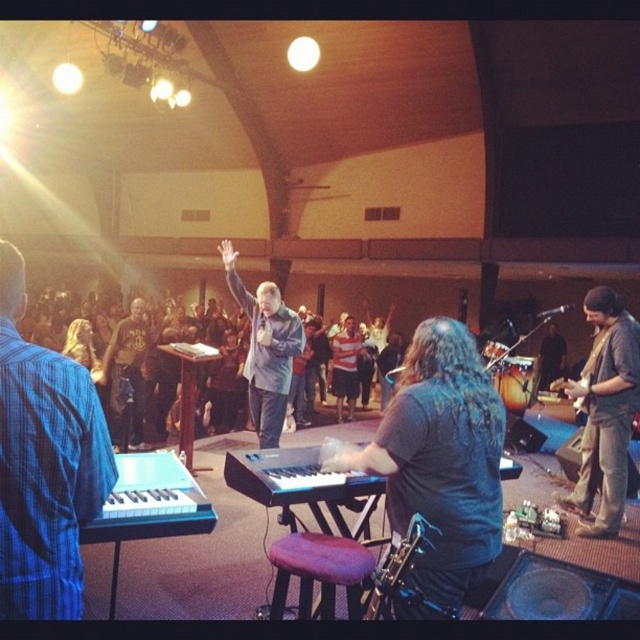
Question: Is purple fabric stool at center smaller than dark brown leather jacket at center?

Choices:
 (A) no
 (B) yes

Answer: (B)

Question: Is purple fabric stool at center positioned before metallic silver saxophone at center?

Choices:
 (A) yes
 (B) no

Answer: (B)

Question: Estimate the real-world distances between objects in this image. Which object is closer to the blue plaid shirt at left?

Choices:
 (A) dark brown leather jacket at center
 (B) matte gray suit at center
 (C) black plastic keyboard at center

Answer: (C)

Question: Which object is the closest to the dark brown leather jacket at center?

Choices:
 (A) matte gray suit at center
 (B) black plastic keyboard at center
 (C) denim jacket at right
 (D) blue plaid shirt at left

Answer: (A)

Question: Which point is farther from the camera taking this photo?

Choices:
 (A) (72, 369)
 (B) (273, 282)
 (C) (324, 496)
 (D) (410, 561)

Answer: (B)

Question: Is denim jacket at right wider than black plastic keyboard at center?

Choices:
 (A) yes
 (B) no

Answer: (B)